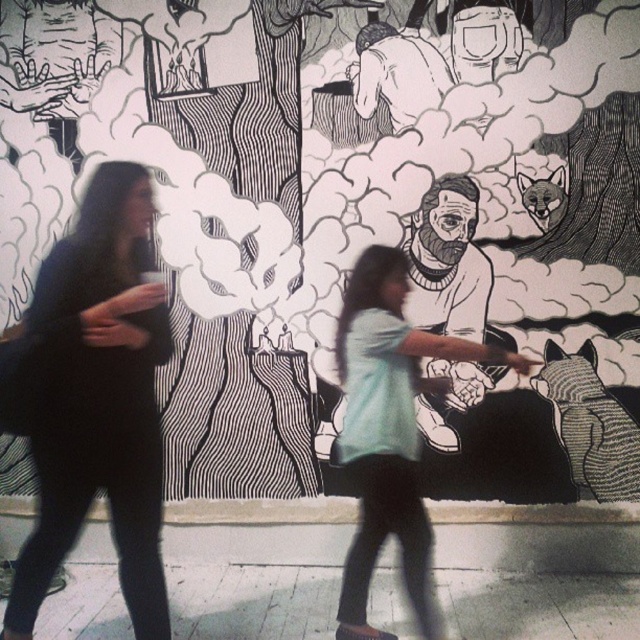
You are a photographer trying to capture both the black matte dress at left and the light blue shirt at center in a single frame. Based on their sizes in the image, which one should you focus on first to ensure both are in focus?

The black matte dress at left is much taller than the light blue shirt at center, so focusing on the black matte dress at left first would help ensure both are in focus since it is larger and likely closer to the camera.

You are a photographer trying to capture both the black matte dress at left and the light blue shirt at center in a single frame. Given their sizes, which one should you focus on to ensure both are clearly visible?

Since the black matte dress at left is smaller in size compared to the light blue shirt at center, you should focus on the light blue shirt at center to ensure both are clearly visible in the frame.

You are a photographer standing in front of the mural. You want to take a clear photo of the black matte dress at left without blurring it. Considering the dress is 8.33 feet away, what is the minimum focusing distance your camera should have to capture it sharply?

The black matte dress at left is 8.33 feet away from the camera, so the camera must have a focusing distance of at least 8.33 feet to capture it sharply without blur.